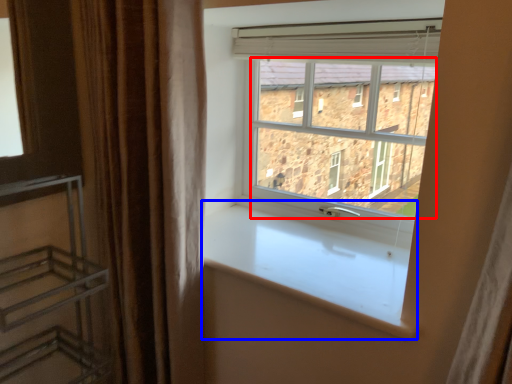
Question: Which point is further to the camera, window screen (highlighted by a red box) or window sill (highlighted by a blue box)?

Choices:
 (A) window screen
 (B) window sill

Answer: (A)